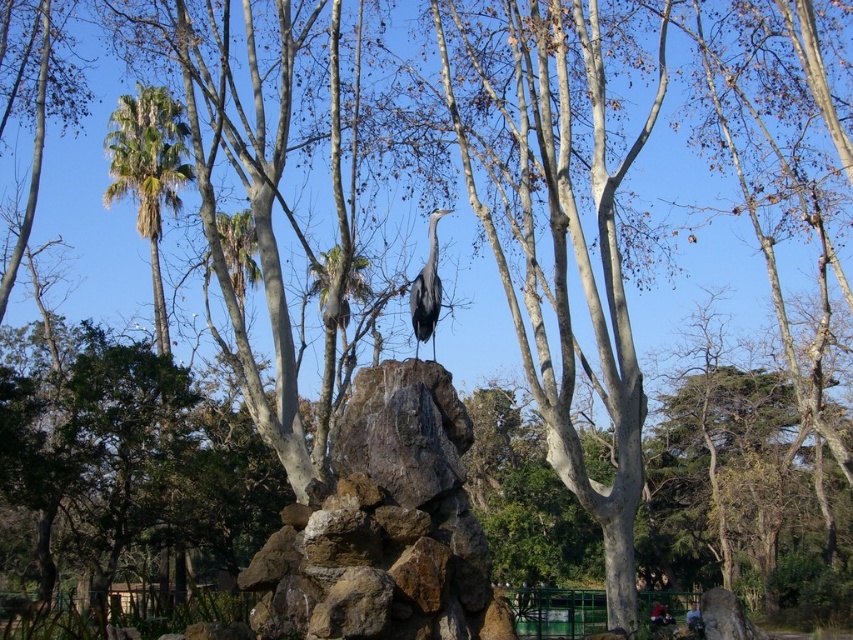
Question: Which object appears closest to the camera in this image?

Choices:
 (A) gray matte heron at center
 (B) brown rough rock at center

Answer: (B)

Question: Which object is farther from the camera taking this photo?

Choices:
 (A) gray matte heron at center
 (B) green leafy palm at left
 (C) brown rough rock at center

Answer: (B)

Question: Observing the image, what is the correct spatial positioning of brown rough rock at center in reference to green leafy palm at left?

Choices:
 (A) above
 (B) below

Answer: (B)

Question: Does brown rough rock at center have a lesser width compared to green leafy palm at left?

Choices:
 (A) yes
 (B) no

Answer: (A)

Question: Estimate the real-world distances between objects in this image. Which object is closer to the green leafy palm at left?

Choices:
 (A) brown rough rock at center
 (B) gray matte heron at center

Answer: (B)

Question: Where is brown rough rock at center located in relation to green leafy palm at left in the image?

Choices:
 (A) right
 (B) left

Answer: (A)